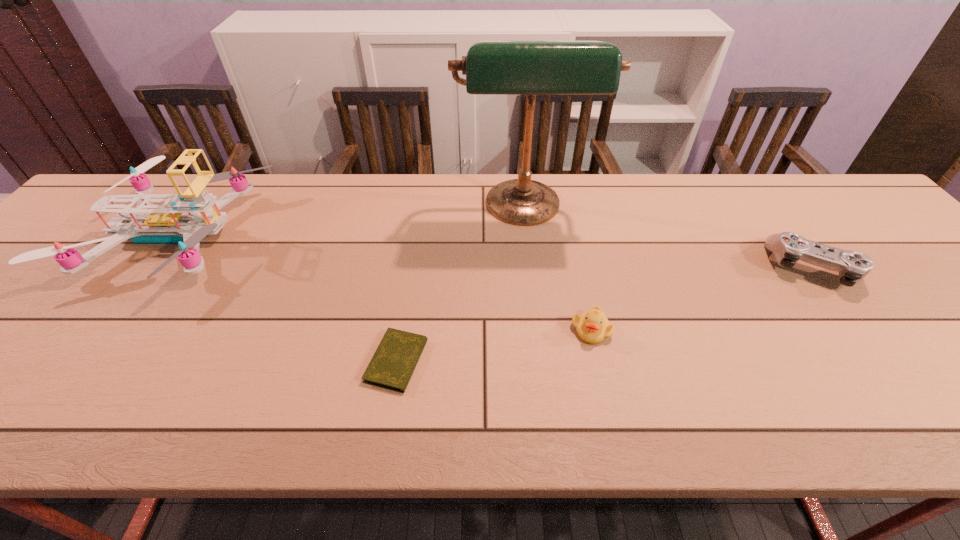
Where is `empty location between the second object from left to right and the tallest object`? The image size is (960, 540). empty location between the second object from left to right and the tallest object is located at coordinates (460, 286).

Locate an element on the screen. The height and width of the screenshot is (540, 960). free spot between the table lamp and the fourth object from right to left is located at coordinates (460, 286).

At what (x,y) coordinates should I click in order to perform the action: click on vacant space that is in between the control and the drone. Please return your answer as a coordinate pair (x, y). This screenshot has width=960, height=540. Looking at the image, I should click on (493, 252).

This screenshot has width=960, height=540. What are the coordinates of `free point between the table lamp and the diary` in the screenshot? It's located at (460, 286).

Identify the location of empty space that is in between the table lamp and the second object from left to right. The image size is (960, 540). (460, 286).

Where is `blank region between the leftmost object and the shortest object`? This screenshot has height=540, width=960. blank region between the leftmost object and the shortest object is located at coordinates (286, 299).

This screenshot has height=540, width=960. Find the location of `free spot between the shortest object and the fourth shortest object`. free spot between the shortest object and the fourth shortest object is located at coordinates (286, 299).

You are a GUI agent. You are given a task and a screenshot of the screen. Output one action in this format:
    pyautogui.click(x=<x>, y=<y>)
    Task: Click on the free space that is in between the duckling and the drone
    The height and width of the screenshot is (540, 960).
    Given the screenshot: What is the action you would take?
    [x=383, y=282]

Image resolution: width=960 pixels, height=540 pixels. What are the coordinates of `free space between the duckling and the fourth object from right to left` in the screenshot? It's located at [494, 346].

Identify which object is located as the nearest to the tallest object. Please provide its 2D coordinates. Your answer should be formatted as a tuple, i.e. [(x, y)], where the tuple contains the x and y coordinates of a point satisfying the conditions above.

[(593, 327)]